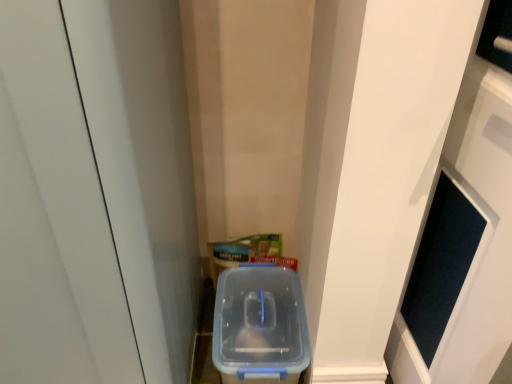
Measure the distance between point (x=214, y=356) and camera.

1.11 meters.

The image size is (512, 384). Describe the element at coordinates (260, 326) in the screenshot. I see `translucent plastic container at center` at that location.

Find the location of a particular element. translucent plastic container at center is located at coordinates (260, 326).

Image resolution: width=512 pixels, height=384 pixels. What are the coordinates of `translucent plastic container at center` in the screenshot? It's located at (260, 326).